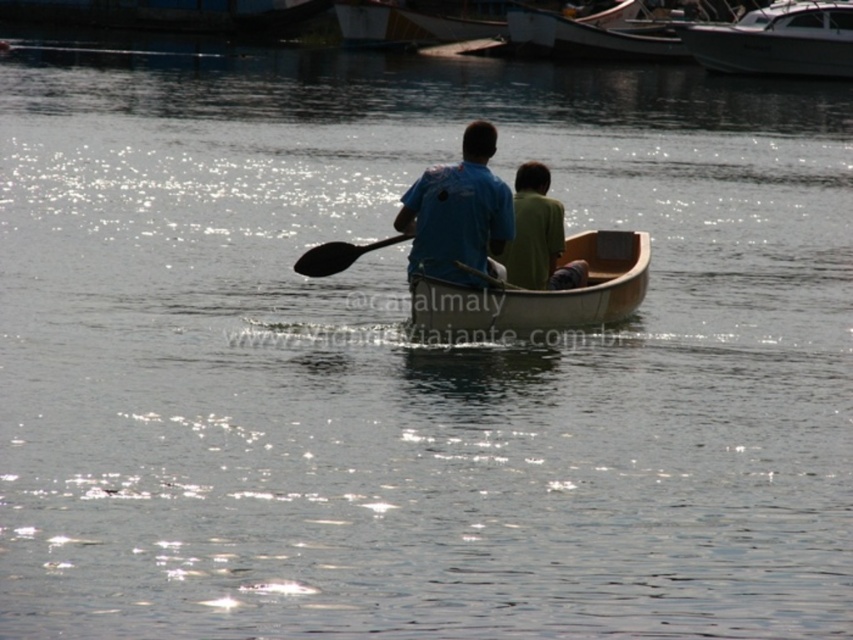
Is point (825, 56) less distant than point (338, 243)?

That is False.

How far apart are white glossy boat at upper right and black wood paddle at center?

white glossy boat at upper right and black wood paddle at center are 34.32 meters apart.

The image size is (853, 640). Describe the element at coordinates (778, 40) in the screenshot. I see `white glossy boat at upper right` at that location.

The image size is (853, 640). I want to click on white glossy boat at upper right, so click(x=778, y=40).

Can you confirm if matte blue shirt at center is positioned to the left of green matte shirt at center?

Correct, you'll find matte blue shirt at center to the left of green matte shirt at center.

Does matte blue shirt at center appear on the right side of green matte shirt at center?

No, matte blue shirt at center is not to the right of green matte shirt at center.

Image resolution: width=853 pixels, height=640 pixels. I want to click on matte blue shirt at center, so click(457, 212).

Which is in front, point (772, 19) or point (665, 49)?

Point (772, 19) is in front.

Is point (753, 67) behind point (645, 28)?

That is False.

Measure the distance between white glossy boat at upper right and camera.

white glossy boat at upper right is 168.66 feet away from camera.

Identify the location of white glossy boat at upper right. 778,40.